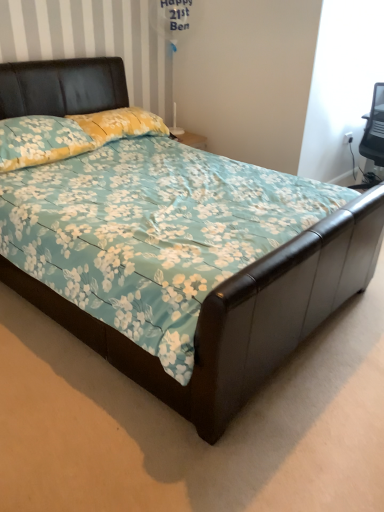
What do you see at coordinates (120, 124) in the screenshot? I see `floral fabric pillow at upper left, arranged as the first pillow when viewed from the back` at bounding box center [120, 124].

You are a GUI agent. You are given a task and a screenshot of the screen. Output one action in this format:
    pyautogui.click(x=<x>, y=<y>)
    Task: Click on the floral fabric pillow at upper left, arranged as the first pillow when viewed from the back
    This screenshot has height=512, width=384.
    Given the screenshot: What is the action you would take?
    pyautogui.click(x=120, y=124)

Image resolution: width=384 pixels, height=512 pixels. What do you see at coordinates (40, 141) in the screenshot?
I see `floral fabric pillow at upper left, the 2th pillow positioned from the back` at bounding box center [40, 141].

How much space does floral fabric pillow at upper left, which appears as the 1th pillow when viewed from the front, occupy vertically?

floral fabric pillow at upper left, which appears as the 1th pillow when viewed from the front, is 25.59 centimeters tall.

You are a GUI agent. You are given a task and a screenshot of the screen. Output one action in this format:
    pyautogui.click(x=<x>, y=<y>)
    Task: Click on the floral fabric pillow at upper left, which appears as the 1th pillow when viewed from the front
    
    Given the screenshot: What is the action you would take?
    pyautogui.click(x=40, y=141)

Where is `floral fabric pillow at upper left, which is counted as the 2th pillow, starting from the front`? The height and width of the screenshot is (512, 384). floral fabric pillow at upper left, which is counted as the 2th pillow, starting from the front is located at coordinates (120, 124).

In the image, is floral fabric pillow at upper left, which appears as the 1th pillow when viewed from the front, on the left side or the right side of floral fabric pillow at upper left, arranged as the first pillow when viewed from the back?

Based on their positions, floral fabric pillow at upper left, which appears as the 1th pillow when viewed from the front, is located to the left of floral fabric pillow at upper left, arranged as the first pillow when viewed from the back.

Is floral fabric pillow at upper left, the 2th pillow positioned from the back, in front of or behind floral fabric pillow at upper left, which is counted as the 2th pillow, starting from the front, in the image?

floral fabric pillow at upper left, the 2th pillow positioned from the back, is positioned closer to the viewer than floral fabric pillow at upper left, which is counted as the 2th pillow, starting from the front.

Which point is more distant from viewer, [28,141] or [87,117]?

The point [87,117] is more distant.

Looking at this image, from the image's perspective, which object appears higher, floral fabric pillow at upper left, the 2th pillow positioned from the back, or floral fabric pillow at upper left, arranged as the first pillow when viewed from the back?

floral fabric pillow at upper left, arranged as the first pillow when viewed from the back, from the image's perspective.

From a real-world perspective, relative to floral fabric pillow at upper left, arranged as the first pillow when viewed from the back, is floral fabric pillow at upper left, the 2th pillow positioned from the back, vertically above or below?

From a real-world perspective, floral fabric pillow at upper left, the 2th pillow positioned from the back, is physically below floral fabric pillow at upper left, arranged as the first pillow when viewed from the back.

Considering the relative sizes of floral fabric pillow at upper left, the 2th pillow positioned from the back, and floral fabric pillow at upper left, which is counted as the 2th pillow, starting from the front, in the image provided, is floral fabric pillow at upper left, the 2th pillow positioned from the back, thinner than floral fabric pillow at upper left, which is counted as the 2th pillow, starting from the front,?

Incorrect, the width of floral fabric pillow at upper left, the 2th pillow positioned from the back, is not less than that of floral fabric pillow at upper left, which is counted as the 2th pillow, starting from the front.

Considering the relative sizes of floral fabric pillow at upper left, which appears as the 1th pillow when viewed from the front, and floral fabric pillow at upper left, arranged as the first pillow when viewed from the back, in the image provided, is floral fabric pillow at upper left, which appears as the 1th pillow when viewed from the front, shorter than floral fabric pillow at upper left, arranged as the first pillow when viewed from the back,?

Incorrect, the height of floral fabric pillow at upper left, which appears as the 1th pillow when viewed from the front, does not fall short of that of floral fabric pillow at upper left, arranged as the first pillow when viewed from the back.

Is floral fabric pillow at upper left, the 2th pillow positioned from the back, bigger than floral fabric pillow at upper left, arranged as the first pillow when viewed from the back?

Indeed, floral fabric pillow at upper left, the 2th pillow positioned from the back, has a larger size compared to floral fabric pillow at upper left, arranged as the first pillow when viewed from the back.

Is floral fabric pillow at upper left, arranged as the first pillow when viewed from the back, located within floral fabric pillow at upper left, the 2th pillow positioned from the back?

No, floral fabric pillow at upper left, arranged as the first pillow when viewed from the back, is located outside of floral fabric pillow at upper left, the 2th pillow positioned from the back.

Based on the photo, is floral fabric pillow at upper left, which appears as the 1th pillow when viewed from the front, not near floral fabric pillow at upper left, arranged as the first pillow when viewed from the back?

No, floral fabric pillow at upper left, which appears as the 1th pillow when viewed from the front, is not far away from floral fabric pillow at upper left, arranged as the first pillow when viewed from the back.

Is floral fabric pillow at upper left, the 2th pillow positioned from the back, positioned with its back to floral fabric pillow at upper left, arranged as the first pillow when viewed from the back?

floral fabric pillow at upper left, the 2th pillow positioned from the back, does not have its back to floral fabric pillow at upper left, arranged as the first pillow when viewed from the back.

How many degrees apart are the facing directions of floral fabric pillow at upper left, the 2th pillow positioned from the back, and floral fabric pillow at upper left, which is counted as the 2th pillow, starting from the front?

The angle between the facing direction of floral fabric pillow at upper left, the 2th pillow positioned from the back, and the facing direction of floral fabric pillow at upper left, which is counted as the 2th pillow, starting from the front, is 3.14 degrees.

Measure the distance between floral fabric pillow at upper left, the 2th pillow positioned from the back, and floral fabric pillow at upper left, arranged as the first pillow when viewed from the back.

They are 12.22 inches apart.

This screenshot has height=512, width=384. In order to click on pillow lying in front of the floral fabric pillow at upper left, arranged as the first pillow when viewed from the back in this screenshot , I will do `click(40, 141)`.

Considering the positions of objects floral fabric pillow at upper left, arranged as the first pillow when viewed from the back, and floral fabric pillow at upper left, which appears as the 1th pillow when viewed from the front, in the image provided, who is more to the left, floral fabric pillow at upper left, arranged as the first pillow when viewed from the back, or floral fabric pillow at upper left, which appears as the 1th pillow when viewed from the front,?

Positioned to the left is floral fabric pillow at upper left, which appears as the 1th pillow when viewed from the front.

Is floral fabric pillow at upper left, which is counted as the 2th pillow, starting from the front, further to camera compared to floral fabric pillow at upper left, which appears as the 1th pillow when viewed from the front?

Yes, floral fabric pillow at upper left, which is counted as the 2th pillow, starting from the front, is behind floral fabric pillow at upper left, which appears as the 1th pillow when viewed from the front.

Is point (110, 127) in front of point (81, 128)?

No, it is behind (81, 128).

From the image's perspective, is floral fabric pillow at upper left, which is counted as the 2th pillow, starting from the front, above floral fabric pillow at upper left, which appears as the 1th pillow when viewed from the front?

Indeed, from the image's perspective, floral fabric pillow at upper left, which is counted as the 2th pillow, starting from the front, is shown above floral fabric pillow at upper left, which appears as the 1th pillow when viewed from the front.

From a real-world perspective, which object rests below the other?

In real-world perspective, floral fabric pillow at upper left, the 2th pillow positioned from the back, is lower.

Looking at this image, looking at their sizes, would you say floral fabric pillow at upper left, which is counted as the 2th pillow, starting from the front, is wider or thinner than floral fabric pillow at upper left, the 2th pillow positioned from the back?

Considering their sizes, floral fabric pillow at upper left, which is counted as the 2th pillow, starting from the front, looks slimmer than floral fabric pillow at upper left, the 2th pillow positioned from the back.

Which of these two, floral fabric pillow at upper left, which is counted as the 2th pillow, starting from the front, or floral fabric pillow at upper left, the 2th pillow positioned from the back, stands shorter?

floral fabric pillow at upper left, which is counted as the 2th pillow, starting from the front, is shorter.

Does floral fabric pillow at upper left, which is counted as the 2th pillow, starting from the front, have a larger size compared to floral fabric pillow at upper left, which appears as the 1th pillow when viewed from the front?

Actually, floral fabric pillow at upper left, which is counted as the 2th pillow, starting from the front, might be smaller than floral fabric pillow at upper left, which appears as the 1th pillow when viewed from the front.

Is floral fabric pillow at upper left, arranged as the first pillow when viewed from the back, positioned beyond the bounds of floral fabric pillow at upper left, which appears as the 1th pillow when viewed from the front?

Yes.

Are floral fabric pillow at upper left, which is counted as the 2th pillow, starting from the front, and floral fabric pillow at upper left, which appears as the 1th pillow when viewed from the front, far apart?

Actually, floral fabric pillow at upper left, which is counted as the 2th pillow, starting from the front, and floral fabric pillow at upper left, which appears as the 1th pillow when viewed from the front, are a little close together.

Is floral fabric pillow at upper left, which is counted as the 2th pillow, starting from the front, facing away from floral fabric pillow at upper left, the 2th pillow positioned from the back?

No, floral fabric pillow at upper left, which is counted as the 2th pillow, starting from the front,'s orientation is not away from floral fabric pillow at upper left, the 2th pillow positioned from the back.

Can you tell me how much floral fabric pillow at upper left, which is counted as the 2th pillow, starting from the front, and floral fabric pillow at upper left, the 2th pillow positioned from the back, differ in facing direction?

There is a 3.14-degree angle between the facing directions of floral fabric pillow at upper left, which is counted as the 2th pillow, starting from the front, and floral fabric pillow at upper left, the 2th pillow positioned from the back.

Identify the location of pillow above the floral fabric pillow at upper left, which appears as the 1th pillow when viewed from the front (from a real-world perspective). Image resolution: width=384 pixels, height=512 pixels. (120, 124).

Image resolution: width=384 pixels, height=512 pixels. Identify the location of pillow above the floral fabric pillow at upper left, the 2th pillow positioned from the back (from a real-world perspective). (120, 124).

The height and width of the screenshot is (512, 384). Identify the location of pillow below the floral fabric pillow at upper left, which is counted as the 2th pillow, starting from the front (from the image's perspective). (40, 141).